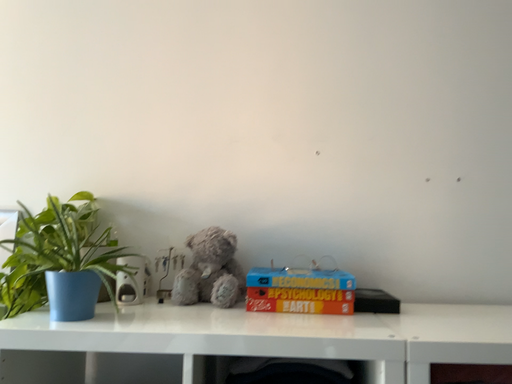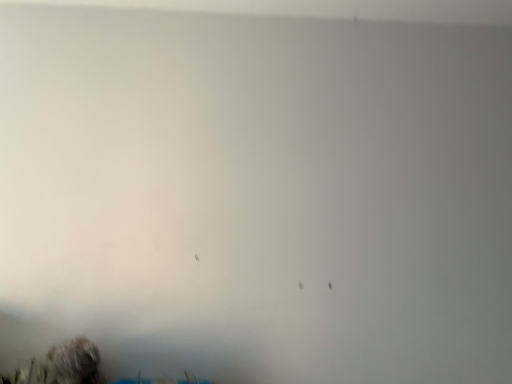
Question: Which way did the camera rotate in the video?

Choices:
 (A) rotated downward
 (B) rotated upward

Answer: (B)